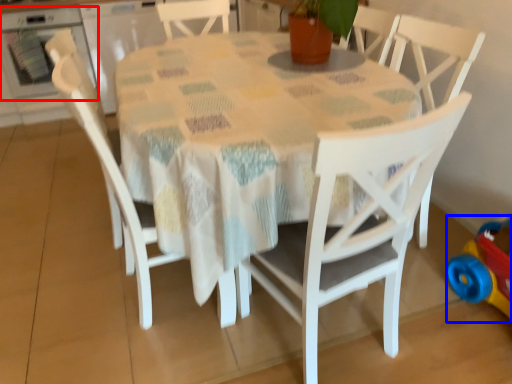
Question: Which of the following is the closest to the observer, oven (highlighted by a red box) or toy (highlighted by a blue box)?

Choices:
 (A) oven
 (B) toy

Answer: (B)